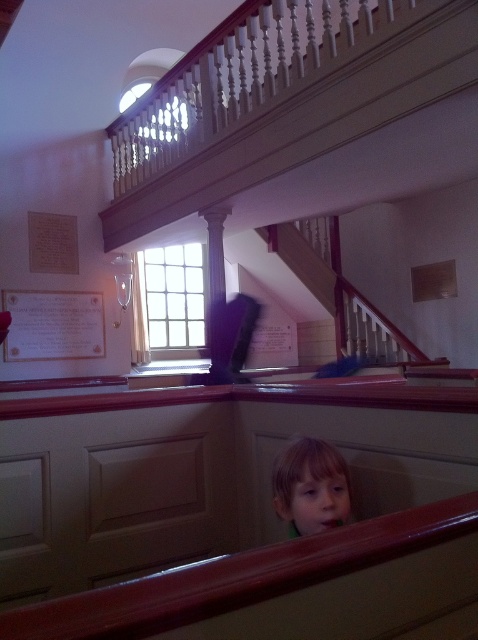
Question: Is white wooden staircase at upper center positioned at the back of light brown hair at center?

Choices:
 (A) yes
 (B) no

Answer: (A)

Question: Considering the real-world distances, which object is closest to the white wooden staircase at upper center?

Choices:
 (A) white paper at upper left
 (B) light brown hair at center

Answer: (A)

Question: Considering the relative positions of white paper at upper left and light brown hair at center in the image provided, where is white paper at upper left located with respect to light brown hair at center?

Choices:
 (A) below
 (B) above

Answer: (B)

Question: Is white paper at upper left to the right of light brown hair at center from the viewer's perspective?

Choices:
 (A) yes
 (B) no

Answer: (B)

Question: Which point is farther to the camera?

Choices:
 (A) white paper at upper left
 (B) light brown hair at center

Answer: (A)

Question: Which object appears farthest from the camera in this image?

Choices:
 (A) light brown hair at center
 (B) white paper at upper left
 (C) white wooden staircase at upper center

Answer: (B)